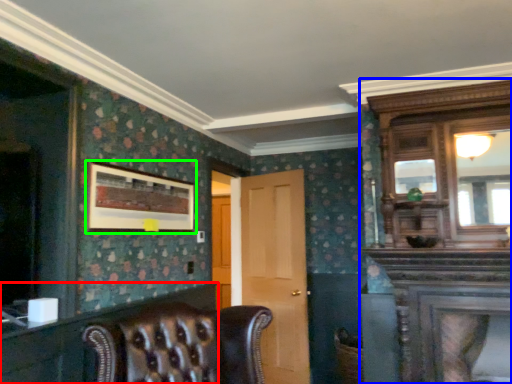
Question: Which object is the closest to the dresser (highlighted by a red box)? Choose among these: dresser (highlighted by a blue box) or picture frame (highlighted by a green box).

Choices:
 (A) dresser
 (B) picture frame

Answer: (B)